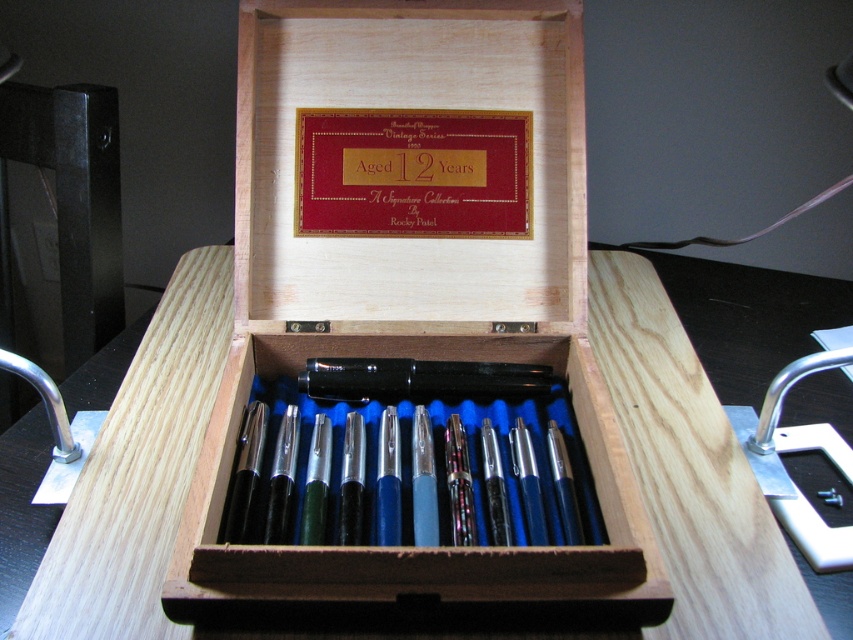
Between wooden box at center and wooden table at center, which one is positioned higher?

wooden box at center

Who is shorter, wooden box at center or wooden table at center?

wooden table at center is shorter.

What do you see at coordinates (410, 330) in the screenshot? I see `wooden box at center` at bounding box center [410, 330].

Locate an element on the screen. The image size is (853, 640). wooden box at center is located at coordinates (410, 330).